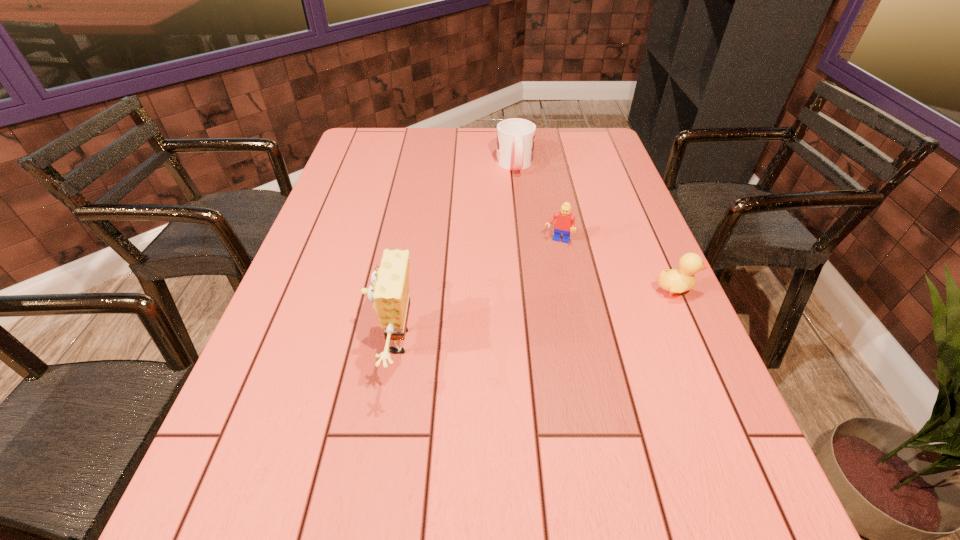
I want to click on vacant space at the near left corner of the desktop, so click(x=227, y=427).

Where is `vacant space at the far right corner`? This screenshot has height=540, width=960. vacant space at the far right corner is located at coordinates (587, 130).

This screenshot has height=540, width=960. Find the location of `vacant area that lies between the Lego and the duckling`. vacant area that lies between the Lego and the duckling is located at coordinates (616, 267).

You are a GUI agent. You are given a task and a screenshot of the screen. Output one action in this format:
    pyautogui.click(x=<x>, y=<y>)
    Task: Click on the vacant area that lies between the mug and the sponge
    The image size is (960, 540).
    Given the screenshot: What is the action you would take?
    pyautogui.click(x=455, y=254)

The height and width of the screenshot is (540, 960). Identify the location of unoccupied area between the sponge and the Lego. (476, 292).

Identify the location of free space between the sponge and the third nearest object. The image size is (960, 540). (476, 292).

Locate an element on the screen. free area in between the farthest object and the duckling is located at coordinates (595, 228).

Where is `empty space between the rightmost object and the farthest object`? The image size is (960, 540). empty space between the rightmost object and the farthest object is located at coordinates (595, 228).

Locate an element on the screen. vacant area that lies between the leftmost object and the mug is located at coordinates (455, 254).

Identify the location of empty location between the farthest object and the tallest object. The height and width of the screenshot is (540, 960). (455, 254).